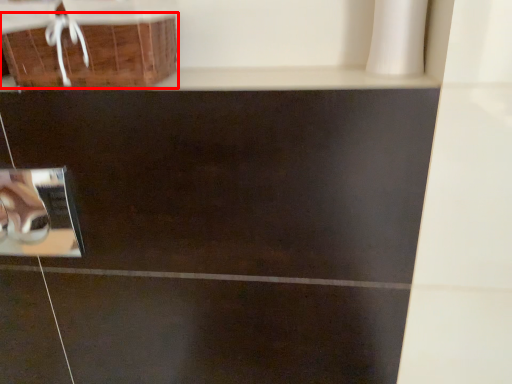
Question: In this image, where is basket (annotated by the red box) located relative to square?

Choices:
 (A) left
 (B) right

Answer: (B)